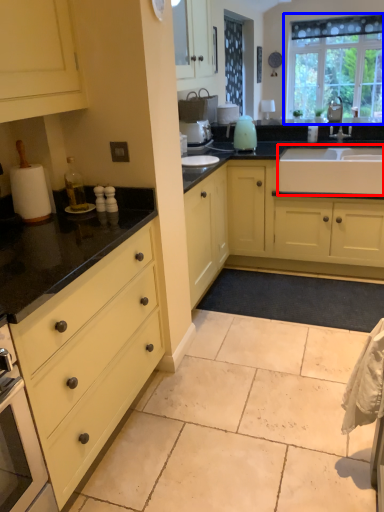
Question: Which object is further to the camera taking this photo, sink (highlighted by a red box) or window (highlighted by a blue box)?

Choices:
 (A) sink
 (B) window

Answer: (B)